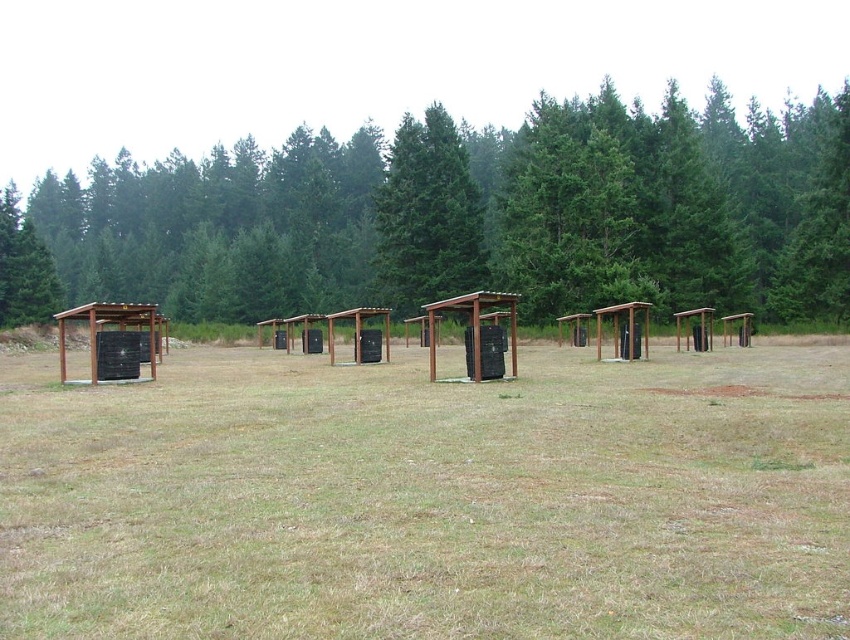
You are a park ranger planning to install a new sign at the shooting range. The sign needs to be placed where it can be seen clearly between the green textured trees at upper center and the matte black shelter at left. Which object should the sign be closer to so it doesn not block the view of the other?

The sign should be placed closer to the matte black shelter at left because the green textured trees at upper center might be wider than the matte black shelter at left, so positioning it near the narrower structure would keep it from obstructing the view of the wider trees.

Looking at this image, you are a photographer planning to capture a wide shot of the shooting range. You want to ensure both the green textured trees at upper center and the brown wooden shelter at center are clearly visible. Which object will appear larger in the final photo?

The green textured trees at upper center will appear larger in the photo because they are described as bigger than the brown wooden shelter at center.

You are a landscape photographer planning to capture the shooting range scene. You want to ensure the brown dry grass at center and the green textured trees at upper center are both visible in your composition. Considering their thickness, which object should you prioritize placing closer to the camera to maintain clarity?

The brown dry grass at center is thinner than the green textured trees at upper center, so to maintain clarity, prioritize placing the brown dry grass at center closer to the camera since thinner objects may require closer focus to be distinct in the photo.